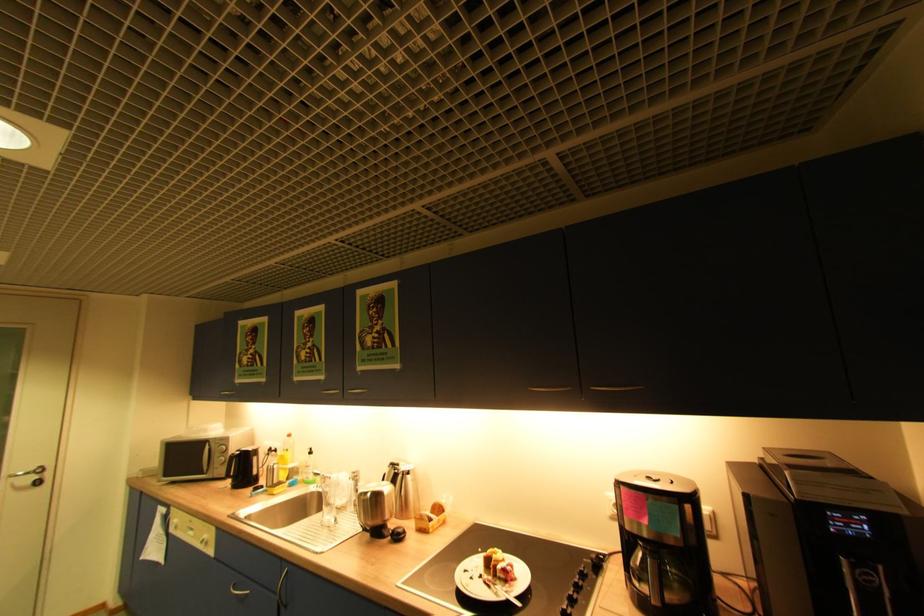
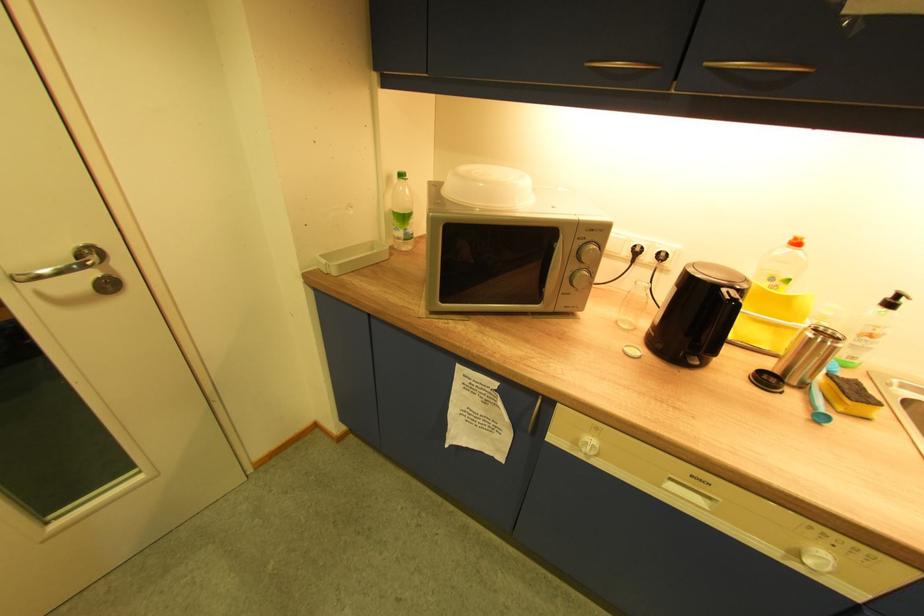
The point at [295,437] is marked in the first image. Where is the corresponding point in the second image?

(803, 244)